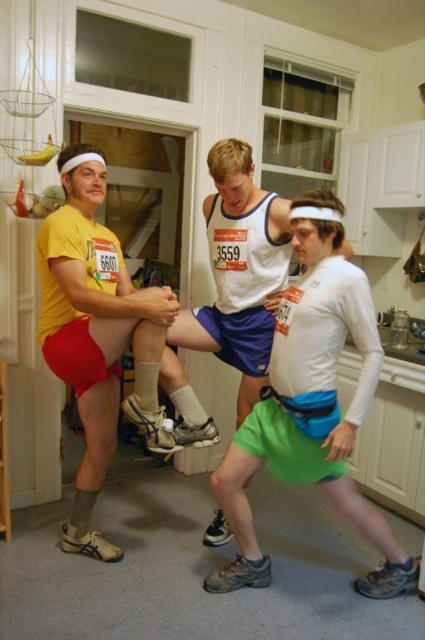
Question: Observing the image, what is the correct spatial positioning of green fabric shorts at center in reference to matte yellow t-shirt at left?

Choices:
 (A) above
 (B) below

Answer: (B)

Question: Is green fabric shorts at center closer to the viewer compared to matte yellow t-shirt at left?

Choices:
 (A) no
 (B) yes

Answer: (B)

Question: Which point is closer to the camera?

Choices:
 (A) matte yellow t-shirt at left
 (B) green fabric shorts at center

Answer: (B)

Question: Is green fabric shorts at center to the left of matte yellow t-shirt at left from the viewer's perspective?

Choices:
 (A) no
 (B) yes

Answer: (A)

Question: Which of the following is the farthest from the observer?

Choices:
 (A) (149, 310)
 (B) (323, 320)

Answer: (A)